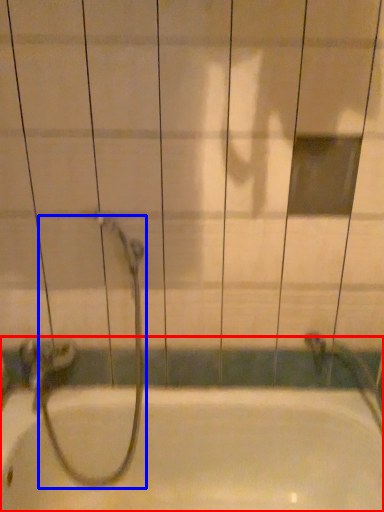
Question: Which point is further to the camera, bathtub (highlighted by a red box) or garden hose (highlighted by a blue box)?

Choices:
 (A) bathtub
 (B) garden hose

Answer: (B)